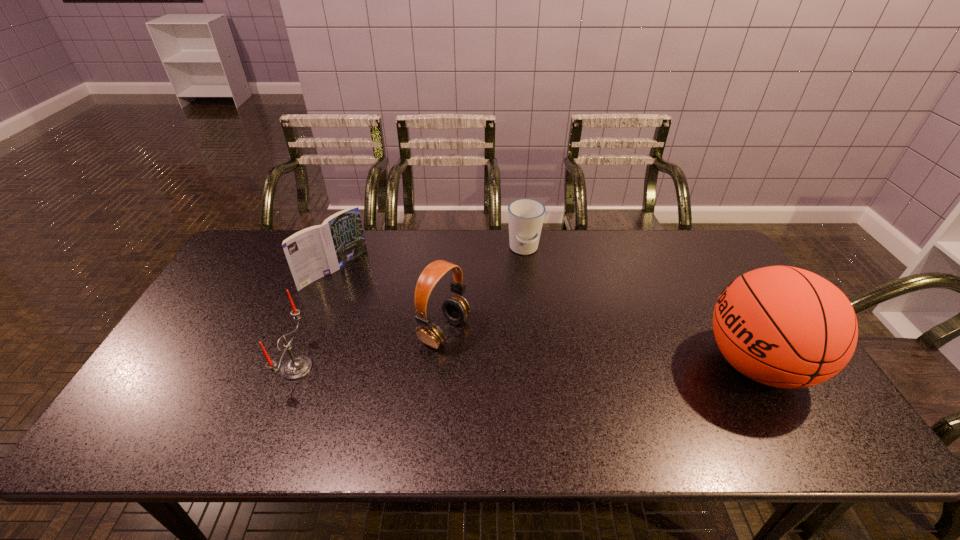
Find the location of a particular element. This screenshot has width=960, height=540. vacant point at the far right corner is located at coordinates point(706,254).

Image resolution: width=960 pixels, height=540 pixels. In the image, there is a desktop. What are the coordinates of `free space at the near right corner` in the screenshot? It's located at (796, 409).

Find the location of a particular element. The image size is (960, 540). free space that is in between the second object from right to left and the headset is located at coordinates (484, 290).

This screenshot has height=540, width=960. Identify the location of vacant area that lies between the cup and the third object from left to right. (484, 290).

You are a GUI agent. You are given a task and a screenshot of the screen. Output one action in this format:
    pyautogui.click(x=<x>, y=<y>)
    Task: Click on the vacant space that is in between the book and the fourth object from left to right
    
    Given the screenshot: What is the action you would take?
    pyautogui.click(x=429, y=260)

The image size is (960, 540). I want to click on vacant space in between the cup and the rightmost object, so click(640, 307).

The image size is (960, 540). In order to click on vacant area that lies between the basketball and the headset in this screenshot , I will do `click(600, 348)`.

At what (x,y) coordinates should I click in order to perform the action: click on vacant space that is in between the book and the cup. Please return your answer as a coordinate pair (x, y). Image resolution: width=960 pixels, height=540 pixels. Looking at the image, I should click on (429, 260).

The height and width of the screenshot is (540, 960). Identify the location of vacant point located between the cup and the basketball. (640, 307).

What are the coordinates of `blank region between the candle and the second object from right to left` in the screenshot? It's located at (410, 308).